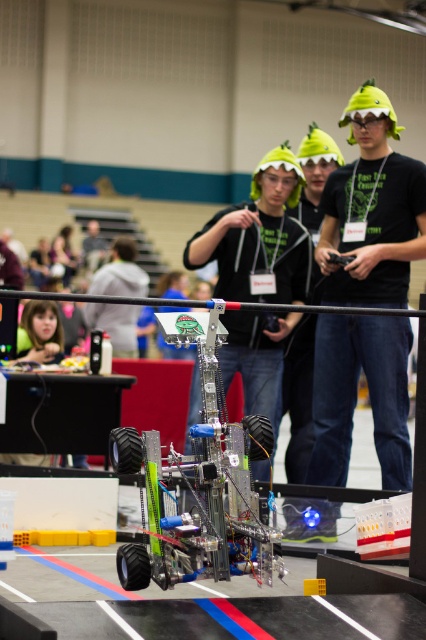
Question: Is green matte hat at upper center in front of metallic/plastic robot at center?

Choices:
 (A) yes
 (B) no

Answer: (B)

Question: Which object appears closest to the camera in this image?

Choices:
 (A) gray fabric shirt at center
 (B) metallic/plastic robot at center
 (C) green matte hat at upper center

Answer: (B)

Question: Does green matte hat at upper center have a greater width compared to gray fabric shirt at center?

Choices:
 (A) no
 (B) yes

Answer: (B)

Question: Observing the image, what is the correct spatial positioning of green matte hat at upper center in reference to gray fabric shirt at center?

Choices:
 (A) below
 (B) above

Answer: (A)

Question: Which point is closer to the camera taking this photo?

Choices:
 (A) (249, 502)
 (B) (100, 307)
 (C) (345, 412)

Answer: (A)

Question: Which point appears farthest from the camera in this image?

Choices:
 (A) (348, 349)
 (B) (138, 566)

Answer: (A)